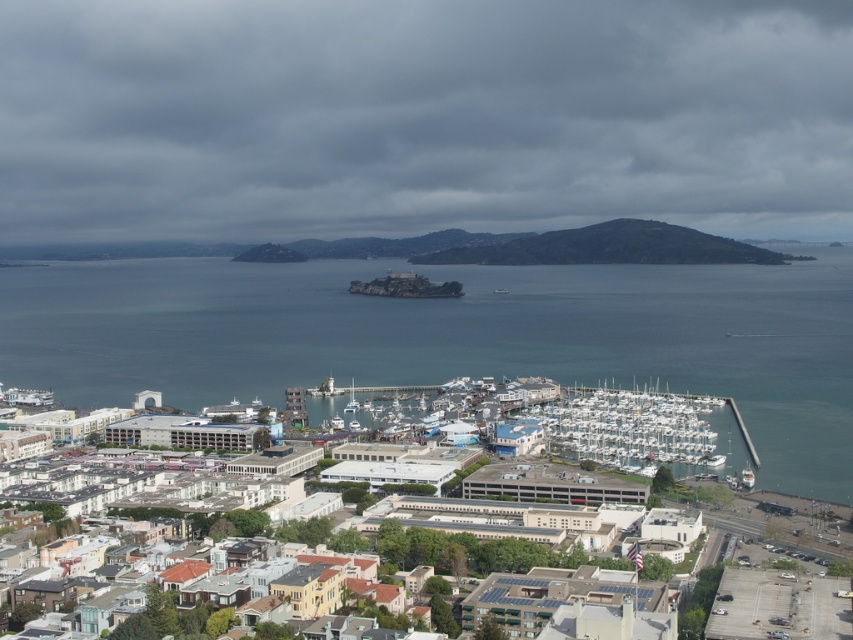
Question: Does dark gray cloud at upper center have a greater width compared to white matte buildings at center?

Choices:
 (A) no
 (B) yes

Answer: (B)

Question: Among these objects, which one is farthest from the camera?

Choices:
 (A) clear blue water at center
 (B) white glossy boat at lower center
 (C) dark gray cloud at upper center
 (D) white matte buildings at center

Answer: (C)

Question: Considering the relative positions of clear blue water at center and white glossy boat at lower center in the image provided, where is clear blue water at center located with respect to white glossy boat at lower center?

Choices:
 (A) below
 (B) above

Answer: (B)

Question: Among these objects, which one is nearest to the camera?

Choices:
 (A) white matte buildings at center
 (B) white glossy boat at lower right
 (C) dark gray cloud at upper center
 (D) white matte boats at center

Answer: (A)

Question: Which object appears closest to the camera in this image?

Choices:
 (A) white matte buildings at center
 (B) clear blue water at center
 (C) white glossy boat at lower right

Answer: (A)

Question: Is dark gray cloud at upper center further to the viewer compared to white glossy boat at lower center?

Choices:
 (A) no
 (B) yes

Answer: (B)